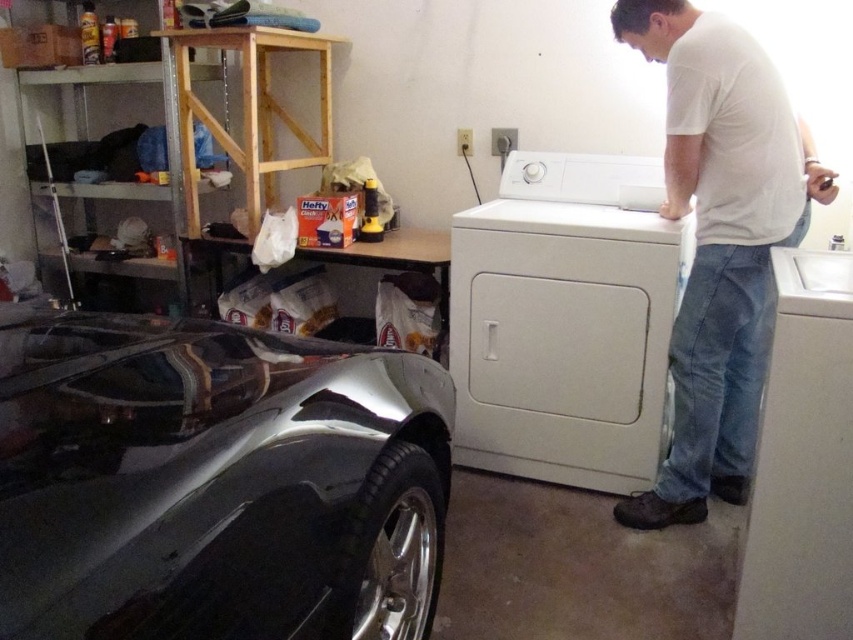
Looking at this image, you are trying to move the white matte washing machine at center to the right side of the glossy metallic car at lower left. Is this possible without moving the car?

The glossy metallic car at lower left is positioned on the left side of white matte washing machine at center. Moving the washing machine to the right of the car would require shifting it past the car, but since the car is already on the left, moving it to the right side of the car would place it further right than its current position. However, the question specifies not moving the car. The current arrangement has the car to the left of the washing machine. To move the washing machine to the right of the

You are standing at the entrance of the garage and want to reach the white matte washing machine at center. According to the coordinates provided, in which direction should you move relative to your current position?

The white matte washing machine at center is located at coordinates point (566, 321). Since you are at the entrance, you should move towards the center of the garage to reach it.

You are trying to move a large box from the garage to your car. The glossy metallic car at lower left and the white cotton shirt at upper right are in your way. Which object should you move first to clear the path?

You should move the glossy metallic car at lower left first because it is positioned on the left side of the white cotton shirt at upper right, meaning it is closer to the path towards the car.